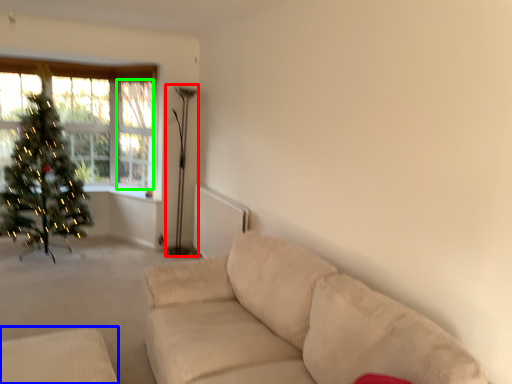
Question: Which object is positioned farthest from lamp (highlighted by a red box)? Select from furniture (highlighted by a blue box) and window screen (highlighted by a green box).

Choices:
 (A) furniture
 (B) window screen

Answer: (A)